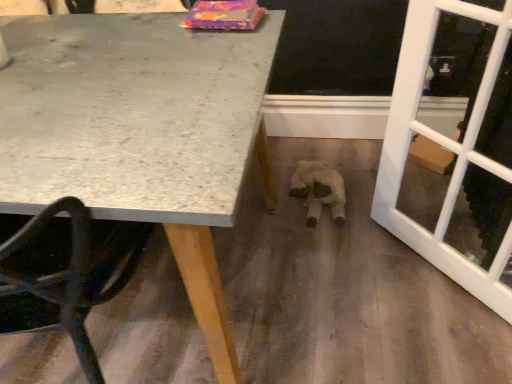
Question: Is white glass screen door at right next to granite table at upper left?

Choices:
 (A) yes
 (B) no

Answer: (B)

Question: Is white glass screen door at right not inside granite table at upper left?

Choices:
 (A) no
 (B) yes

Answer: (B)

Question: From the image's perspective, is white glass screen door at right on granite table at upper left?

Choices:
 (A) no
 (B) yes

Answer: (B)

Question: Considering the relative sizes of white glass screen door at right and granite table at upper left in the image provided, is white glass screen door at right thinner than granite table at upper left?

Choices:
 (A) no
 (B) yes

Answer: (B)

Question: From the image's perspective, is white glass screen door at right under granite table at upper left?

Choices:
 (A) no
 (B) yes

Answer: (A)

Question: From the image's perspective, is white glass screen door at right above or below granite table at upper left?

Choices:
 (A) below
 (B) above

Answer: (B)

Question: Is point (418, 79) closer or farther from the camera than point (121, 41)?

Choices:
 (A) farther
 (B) closer

Answer: (A)

Question: Is white glass screen door at right to the left or to the right of granite table at upper left in the image?

Choices:
 (A) left
 (B) right

Answer: (B)

Question: From a real-world perspective, is white glass screen door at right physically located above or below granite table at upper left?

Choices:
 (A) below
 (B) above

Answer: (B)

Question: Is point (331, 215) closer or farther from the camera than point (197, 99)?

Choices:
 (A) closer
 (B) farther

Answer: (B)

Question: Considering the relative positions of white plush toy at center and granite table at upper left in the image provided, is white plush toy at center to the left or to the right of granite table at upper left?

Choices:
 (A) right
 (B) left

Answer: (A)

Question: From the image's perspective, is white plush toy at center positioned above or below granite table at upper left?

Choices:
 (A) above
 (B) below

Answer: (A)

Question: Choose the correct answer: Is white plush toy at center inside granite table at upper left or outside it?

Choices:
 (A) inside
 (B) outside

Answer: (B)

Question: Considering the relative positions of granite table at upper left and white plush toy at center in the image provided, is granite table at upper left to the left or to the right of white plush toy at center?

Choices:
 (A) left
 (B) right

Answer: (A)

Question: In the image, is granite table at upper left positioned in front of or behind white plush toy at center?

Choices:
 (A) front
 (B) behind

Answer: (A)